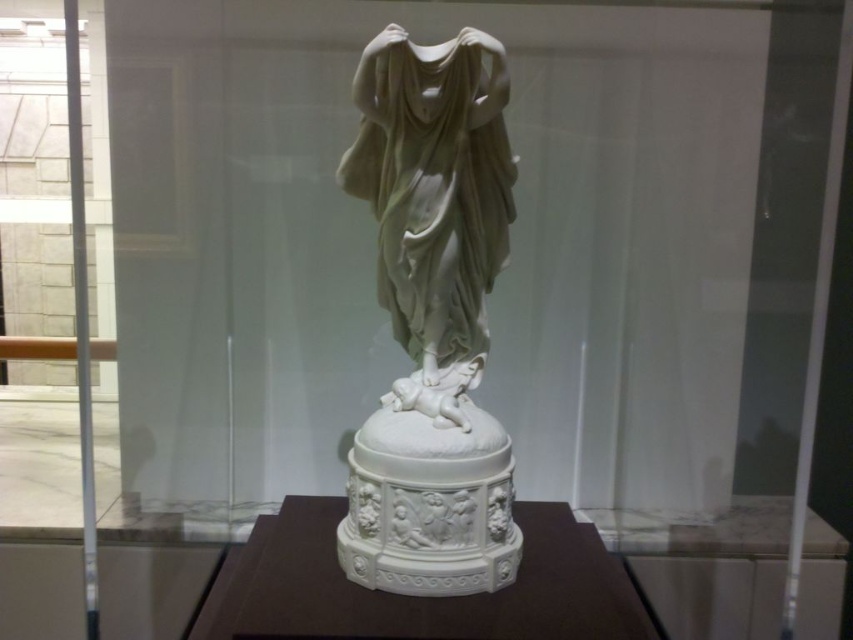
Based on the photo, who is lower down, white marble statue at center or white marble base at center?

white marble base at center is lower down.

Can you confirm if white marble statue at center is smaller than white marble base at center?

Correct, white marble statue at center occupies less space than white marble base at center.

Who is more distant from viewer, (502, 248) or (590, 620)?

Positioned behind is point (502, 248).

Locate an element on the screen. The height and width of the screenshot is (640, 853). white marble statue at center is located at coordinates (432, 317).